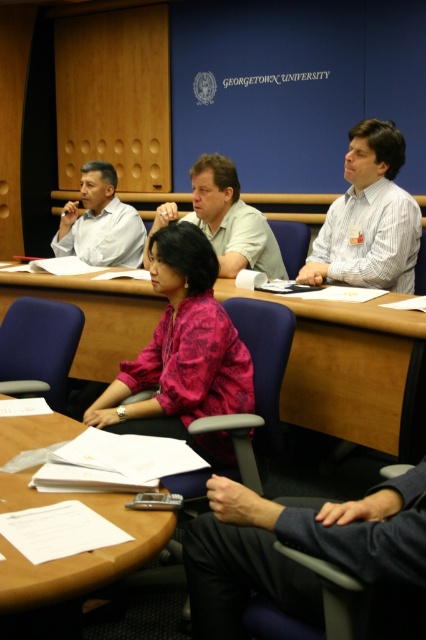
Based on the scene description, can you determine the spatial relationship between the pink floral blouse at center and the wooden table at center?

The pink floral blouse at center is behind the wooden table at center according to the objects description.

Is the wooden table at center wider than the pink floral blouse at center?

The wooden table at center is wider than the pink floral blouse at center according to the description.